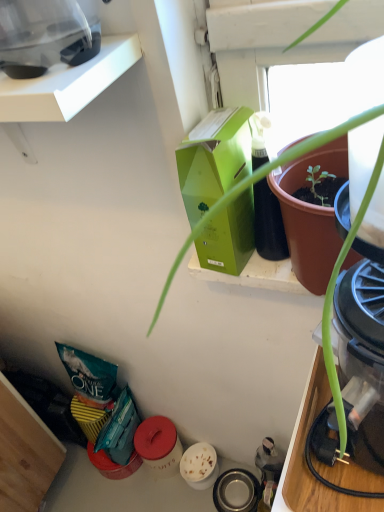
Question: Is transparent plastic blender at upper left, which ranks as the second appliance in back-to-front order, thinner than metallic stainless steel bowl at lower center, the 2th appliance positioned from the left?

Choices:
 (A) yes
 (B) no

Answer: (B)

Question: Considering the relative sizes of transparent plastic blender at upper left, the first appliance from the top, and metallic stainless steel bowl at lower center, the second appliance from the top, in the image provided, is transparent plastic blender at upper left, the first appliance from the top, taller than metallic stainless steel bowl at lower center, the second appliance from the top,?

Choices:
 (A) yes
 (B) no

Answer: (A)

Question: Considering the relative positions of transparent plastic blender at upper left, which is counted as the 2th appliance, starting from the right, and metallic stainless steel bowl at lower center, the 2th appliance positioned from the left, in the image provided, is transparent plastic blender at upper left, which is counted as the 2th appliance, starting from the right, in front of metallic stainless steel bowl at lower center, the 2th appliance positioned from the left,?

Choices:
 (A) no
 (B) yes

Answer: (B)

Question: Is transparent plastic blender at upper left, which is the first appliance from front to back, to the right of metallic stainless steel bowl at lower center, which appears as the first appliance when viewed from the back, from the viewer's perspective?

Choices:
 (A) yes
 (B) no

Answer: (B)

Question: Is transparent plastic blender at upper left, the first appliance from the top, completely or partially outside of metallic stainless steel bowl at lower center, the second appliance from the top?

Choices:
 (A) no
 (B) yes

Answer: (B)

Question: From the image's perspective, relative to metallic stainless steel bowl at lower center, the 2th appliance positioned from the left, is green matte box at upper center above or below?

Choices:
 (A) above
 (B) below

Answer: (A)

Question: Is green matte box at upper center taller or shorter than metallic stainless steel bowl at lower center, arranged as the first appliance when viewed from the right?

Choices:
 (A) short
 (B) tall

Answer: (B)

Question: From a real-world perspective, is green matte box at upper center above or below metallic stainless steel bowl at lower center, placed as the first appliance when sorted from bottom to top?

Choices:
 (A) below
 (B) above

Answer: (B)

Question: In terms of size, does green matte box at upper center appear bigger or smaller than metallic stainless steel bowl at lower center, the 2th appliance positioned from the left?

Choices:
 (A) big
 (B) small

Answer: (A)

Question: From a real-world perspective, is transparent plastic blender at upper left, which is counted as the 2th appliance, starting from the right, positioned above or below metallic stainless steel bowl at lower center, placed as the first appliance when sorted from bottom to top?

Choices:
 (A) below
 (B) above

Answer: (B)

Question: Is transparent plastic blender at upper left, which is the first appliance from front to back, taller or shorter than metallic stainless steel bowl at lower center, which is the second appliance in front-to-back order?

Choices:
 (A) tall
 (B) short

Answer: (A)

Question: Based on their positions, is transparent plastic blender at upper left, which is the first appliance from front to back, located to the left or right of metallic stainless steel bowl at lower center, which appears as the first appliance when viewed from the back?

Choices:
 (A) right
 (B) left

Answer: (B)

Question: Is point (23, 49) positioned closer to the camera than point (223, 506)?

Choices:
 (A) closer
 (B) farther

Answer: (A)

Question: Is metallic stainless steel bowl at lower center, which is the second appliance in front-to-back order, wider or thinner than transparent plastic blender at upper left, which is counted as the 2th appliance, starting from the right?

Choices:
 (A) thin
 (B) wide

Answer: (A)

Question: Considering the positions of metallic stainless steel bowl at lower center, which appears as the first appliance when viewed from the back, and transparent plastic blender at upper left, the first appliance from the top, in the image, is metallic stainless steel bowl at lower center, which appears as the first appliance when viewed from the back, bigger or smaller than transparent plastic blender at upper left, the first appliance from the top,?

Choices:
 (A) big
 (B) small

Answer: (B)